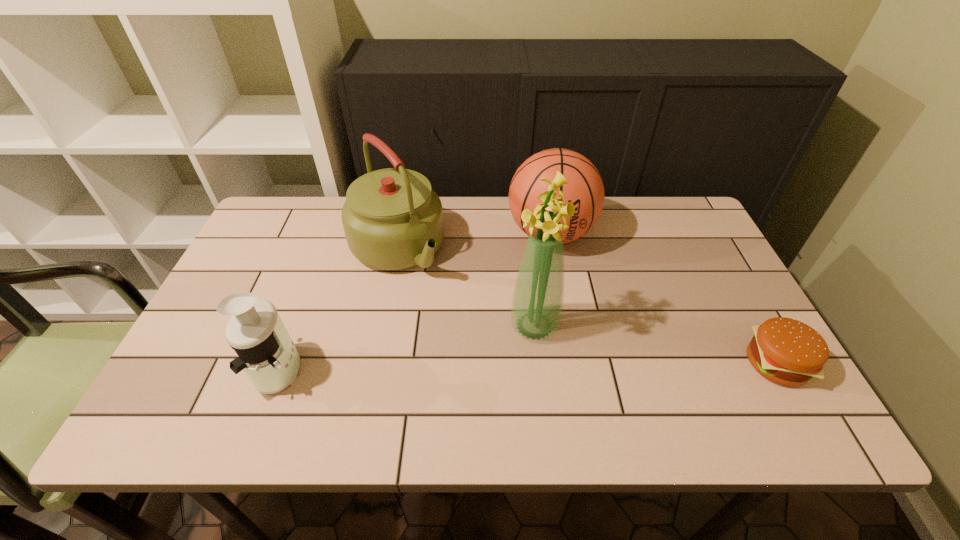
Identify the location of juicer that is at the near edge. (266, 352).

Locate an element on the screen. The height and width of the screenshot is (540, 960). hamburger located in the near edge section of the desktop is located at coordinates (786, 351).

Image resolution: width=960 pixels, height=540 pixels. I want to click on object present at the right edge, so click(786, 351).

What are the coordinates of `object that is at the near right corner` in the screenshot? It's located at (786, 351).

In the image, there is a desktop. Where is `vacant space at the far edge`? This screenshot has height=540, width=960. vacant space at the far edge is located at coordinates (480, 198).

This screenshot has height=540, width=960. In the image, there is a desktop. In order to click on free space at the near edge in this screenshot , I will do `click(415, 383)`.

This screenshot has height=540, width=960. In order to click on free space at the left edge in this screenshot , I will do `click(198, 333)`.

Locate an element on the screen. vacant space at the right edge of the desktop is located at coordinates (690, 301).

I want to click on vacant space at the far left corner of the desktop, so click(274, 236).

In the image, there is a desktop. At what (x,y) coordinates should I click in order to perform the action: click on free space at the far right corner. Please return your answer as a coordinate pair (x, y). Looking at the image, I should click on (683, 235).